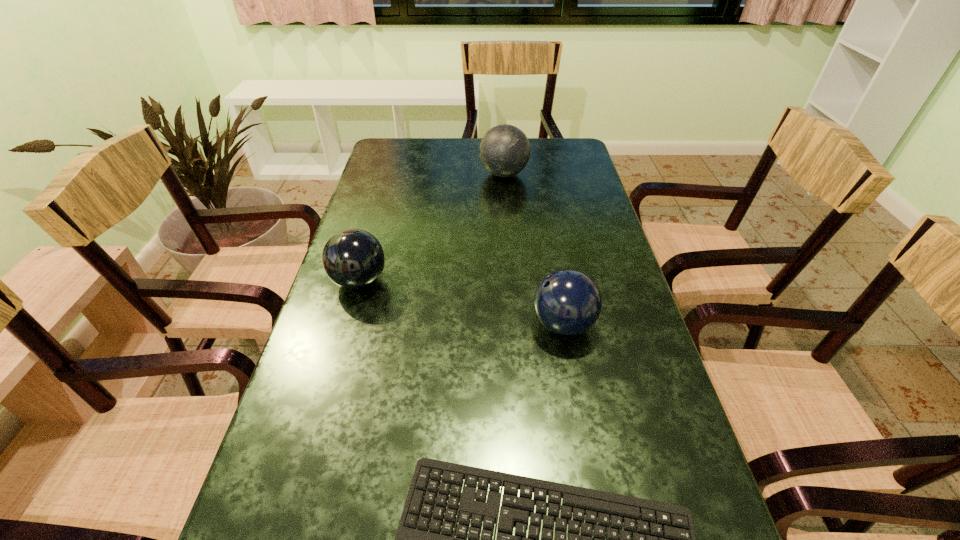
You are a GUI agent. You are given a task and a screenshot of the screen. Output one action in this format:
    pyautogui.click(x=<x>, y=<y>)
    Task: Click on the farthest bowling ball
    This screenshot has height=540, width=960.
    Given the screenshot: What is the action you would take?
    pyautogui.click(x=504, y=151)

This screenshot has width=960, height=540. What are the coordinates of `the second farthest bowling ball` in the screenshot? It's located at (352, 258).

What are the coordinates of `the leftmost bowling ball` in the screenshot? It's located at (352, 258).

The image size is (960, 540). In order to click on the nearest bowling ball in this screenshot , I will do `click(567, 302)`.

The height and width of the screenshot is (540, 960). I want to click on free space located on the grip area of the farthest object, so click(402, 174).

Where is `vacant space situated 0.140m on the grip area of the farthest object`? vacant space situated 0.140m on the grip area of the farthest object is located at coordinates (438, 174).

Locate an element on the screen. vacant region located 0.370m on the grip area of the farthest object is located at coordinates (370, 174).

Where is `blank space located 0.350m on the side of the leftmost object with the finger holes`? The height and width of the screenshot is (540, 960). blank space located 0.350m on the side of the leftmost object with the finger holes is located at coordinates (527, 281).

Identify the location of vacant area situated on the surface of the nearest bowling ball near the finger holes. The height and width of the screenshot is (540, 960). (360, 325).

At what (x,y) coordinates should I click in order to perform the action: click on vacant space located 0.110m on the surface of the nearest bowling ball near the finger holes. Please return your answer as a coordinate pair (x, y). Looking at the image, I should click on click(483, 325).